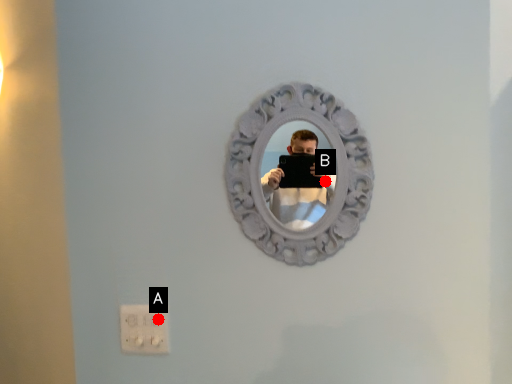
Question: Two points are circled on the image, labeled by A and B beside each circle. Which point is closer to the camera?

Choices:
 (A) A is closer
 (B) B is closer

Answer: (B)